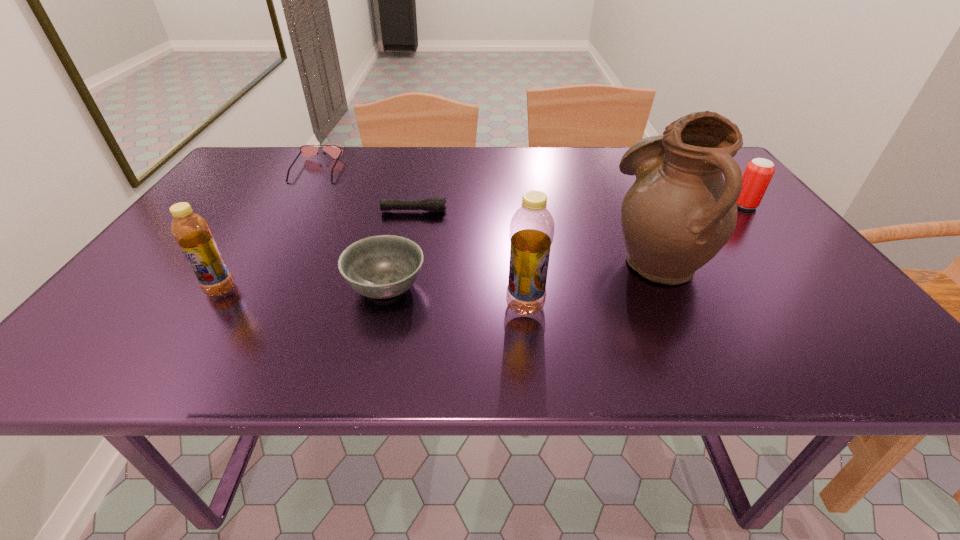
I want to click on the tallest object, so click(x=679, y=213).

Where is `the fifth tallest object`? the fifth tallest object is located at coordinates (384, 266).

Locate an element on the screen. This screenshot has width=960, height=540. free region located on the back of the left bottle is located at coordinates (259, 231).

In order to click on free region located 0.140m on the left of the third object from right to left in this screenshot , I will do (435, 306).

The width and height of the screenshot is (960, 540). Identify the location of free spot located on the front of the beer can. (786, 255).

The height and width of the screenshot is (540, 960). Find the location of `vacant space located on the bridge of the sunglasses`. vacant space located on the bridge of the sunglasses is located at coordinates (258, 269).

Find the location of `free space located 0.120m at the lens end of the flashlight`. free space located 0.120m at the lens end of the flashlight is located at coordinates (492, 211).

Locate an element on the screen. The width and height of the screenshot is (960, 540). vacant area situated at the spout of the sixth object from left to right is located at coordinates (573, 259).

This screenshot has height=540, width=960. I want to click on vacant space located 0.320m at the spout of the sixth object from left to right, so click(467, 259).

Locate an element on the screen. free spot located at the spout of the sixth object from left to right is located at coordinates (506, 259).